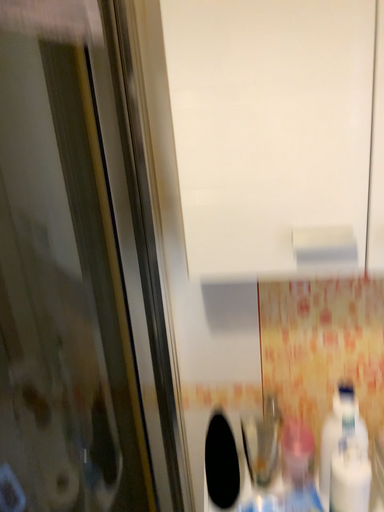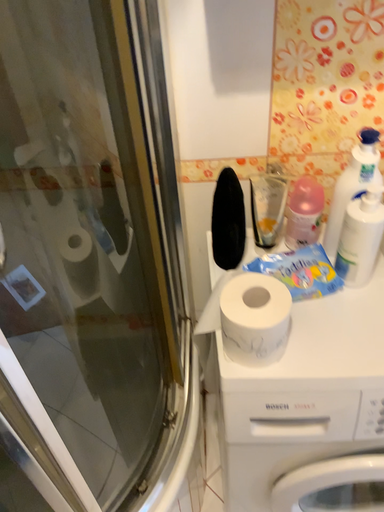
Question: How did the camera likely rotate when shooting the video?

Choices:
 (A) rotated upward
 (B) rotated downward

Answer: (B)